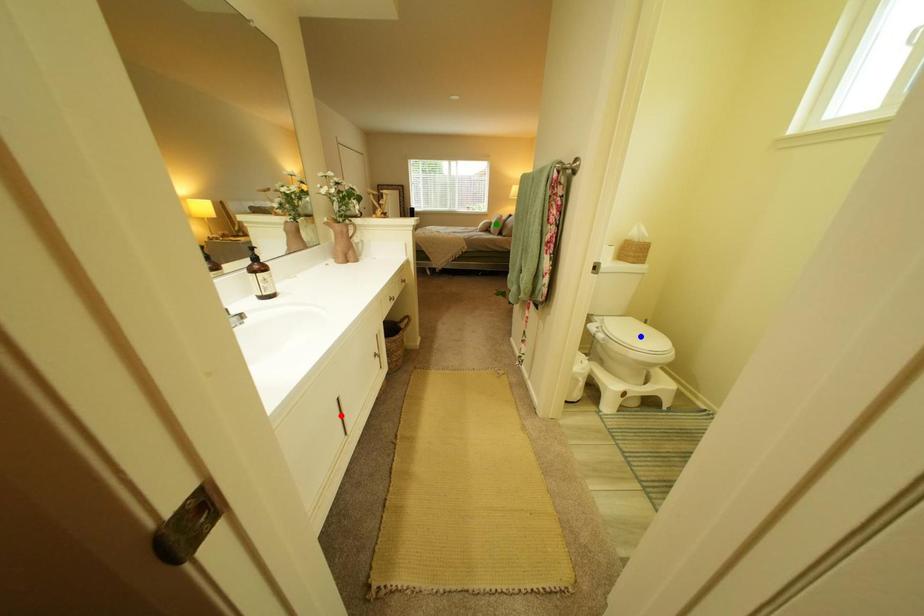
Order these from nearest to farthest:
1. green point
2. blue point
3. red point

red point < blue point < green point